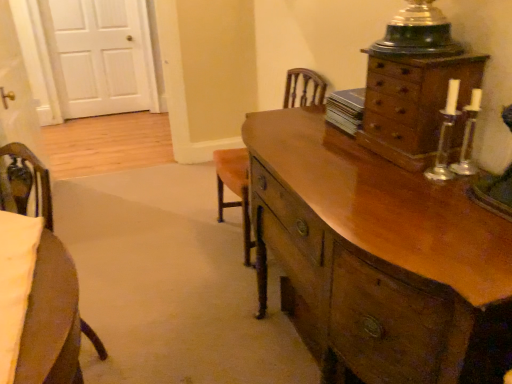
Question: Choose the correct answer: Is shiny brown wooden chest of drawers at right, acting as the first chest of drawers starting from the bottom, inside white wood door at upper left or outside it?

Choices:
 (A) outside
 (B) inside

Answer: (A)

Question: Does point (499, 274) appear closer or farther from the camera than point (70, 6)?

Choices:
 (A) closer
 (B) farther

Answer: (A)

Question: Which object is the closest to the shiny brown wooden chest of drawers at right, placed as the 2th chest of drawers when sorted from top to bottom?

Choices:
 (A) wooden chest of drawers at upper right, the 2th chest of drawers positioned from the bottom
 (B) wooden armchair at center
 (C) white wood door at upper left

Answer: (A)

Question: Which object is positioned farthest from the white wood door at upper left?

Choices:
 (A) wooden chest of drawers at upper right, which is the 1th chest of drawers from top to bottom
 (B) wooden armchair at center
 (C) shiny brown wooden chest of drawers at right, placed as the 2th chest of drawers when sorted from top to bottom

Answer: (A)